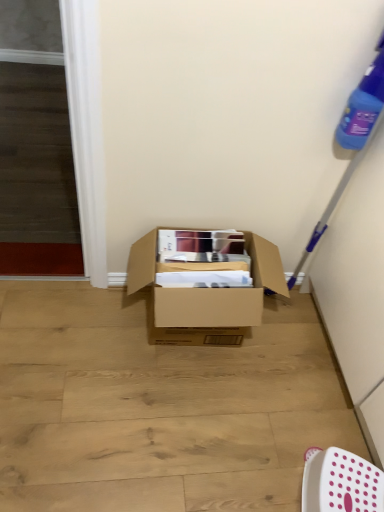
Locate an element on the screen. The height and width of the screenshot is (512, 384). free spot to the right of brown cardboard box at center is located at coordinates (295, 362).